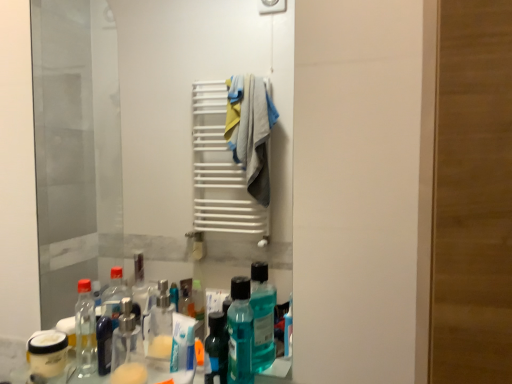
Describe the element at coordinates (146, 138) in the screenshot. I see `transparent glass mirror at center` at that location.

What are the coordinates of `transparent glass mirror at center` in the screenshot? It's located at (146, 138).

Measure the distance between transparent glass mirror at center and camera.

A distance of 6.76 feet exists between transparent glass mirror at center and camera.

The image size is (512, 384). What are the coordinates of `translucent plastic mouthwash at lower center` in the screenshot? It's located at (240, 333).

Measure the distance between translucent plastic mouthwash at lower center and camera.

translucent plastic mouthwash at lower center is 31.41 inches away from camera.

What do you see at coordinates (240, 333) in the screenshot? The height and width of the screenshot is (384, 512). I see `translucent plastic mouthwash at lower center` at bounding box center [240, 333].

Locate an element on the screen. transparent glass mirror at center is located at coordinates (146, 138).

Which object is positioned more to the left, translucent plastic mouthwash at lower center or transparent glass mirror at center?

Positioned to the left is transparent glass mirror at center.

Which object is closer to the camera taking this photo, translucent plastic mouthwash at lower center or transparent glass mirror at center?

translucent plastic mouthwash at lower center is closer to the camera.

Does point (228, 311) come behind point (189, 251)?

No, it is not.

From the image's perspective, is translucent plastic mouthwash at lower center above transparent glass mirror at center?

No, from the image's perspective, translucent plastic mouthwash at lower center is not on top of transparent glass mirror at center.

Looking at this image, from a real-world perspective, is translucent plastic mouthwash at lower center located beneath transparent glass mirror at center?

Yes, from a real-world perspective, translucent plastic mouthwash at lower center is beneath transparent glass mirror at center.

Does translucent plastic mouthwash at lower center have a lesser width compared to transparent glass mirror at center?

No.

Is translucent plastic mouthwash at lower center shorter than transparent glass mirror at center?

Correct, translucent plastic mouthwash at lower center is not as tall as transparent glass mirror at center.

Based on their sizes in the image, would you say translucent plastic mouthwash at lower center is bigger or smaller than transparent glass mirror at center?

In the image, translucent plastic mouthwash at lower center appears to be smaller than transparent glass mirror at center.

Is translucent plastic mouthwash at lower center located outside transparent glass mirror at center?

Yes, translucent plastic mouthwash at lower center is not within transparent glass mirror at center.

Is translucent plastic mouthwash at lower center in contact with transparent glass mirror at center?

No, translucent plastic mouthwash at lower center is not with transparent glass mirror at center.

Is translucent plastic mouthwash at lower center looking in the opposite direction of transparent glass mirror at center?

That's right, translucent plastic mouthwash at lower center is facing away from transparent glass mirror at center.

What are the coordinates of `mirror to the left of translucent plastic mouthwash at lower center` in the screenshot? It's located at (146, 138).

Is transparent glass mirror at center to the left of translucent plastic mouthwash at lower center from the viewer's perspective?

Yes.

Is the position of transparent glass mirror at center more distant than that of translucent plastic mouthwash at lower center?

That is True.

Which is behind, point (135, 42) or point (242, 335)?

Positioned behind is point (135, 42).

From the image's perspective, which is below, transparent glass mirror at center or translucent plastic mouthwash at lower center?

translucent plastic mouthwash at lower center is shown below in the image.

From a real-world perspective, is transparent glass mirror at center above or below translucent plastic mouthwash at lower center?

Clearly, from a real-world perspective, transparent glass mirror at center is above translucent plastic mouthwash at lower center.

Considering the sizes of objects transparent glass mirror at center and translucent plastic mouthwash at lower center in the image provided, who is wider, transparent glass mirror at center or translucent plastic mouthwash at lower center?

With larger width is translucent plastic mouthwash at lower center.

In the scene shown: Does transparent glass mirror at center have a lesser height compared to translucent plastic mouthwash at lower center?

Incorrect, the height of transparent glass mirror at center does not fall short of that of translucent plastic mouthwash at lower center.

Considering the sizes of objects transparent glass mirror at center and translucent plastic mouthwash at lower center in the image provided, who is bigger, transparent glass mirror at center or translucent plastic mouthwash at lower center?

Bigger between the two is transparent glass mirror at center.

Can translucent plastic mouthwash at lower center be found inside transparent glass mirror at center?

No, translucent plastic mouthwash at lower center is not a part of transparent glass mirror at center.

Can you see transparent glass mirror at center touching translucent plastic mouthwash at lower center?

No, transparent glass mirror at center is not beside translucent plastic mouthwash at lower center.

Is transparent glass mirror at center oriented away from translucent plastic mouthwash at lower center?

Absolutely, transparent glass mirror at center is directed away from translucent plastic mouthwash at lower center.

How many degrees apart are the facing directions of transparent glass mirror at center and translucent plastic mouthwash at lower center?

The angle between the facing direction of transparent glass mirror at center and the facing direction of translucent plastic mouthwash at lower center is 0.0678 degrees.

This screenshot has height=384, width=512. Find the location of `mirror lying behind the translucent plastic mouthwash at lower center`. mirror lying behind the translucent plastic mouthwash at lower center is located at coordinates (146, 138).

Locate an element on the screen. mirror positioned vertically above the translucent plastic mouthwash at lower center (from a real-world perspective) is located at coordinates (146, 138).

You are a GUI agent. You are given a task and a screenshot of the screen. Output one action in this format:
    pyautogui.click(x=<x>, y=<y>)
    Task: Click on the mirror on the left of translucent plastic mouthwash at lower center
    The width and height of the screenshot is (512, 384).
    Given the screenshot: What is the action you would take?
    pyautogui.click(x=146, y=138)